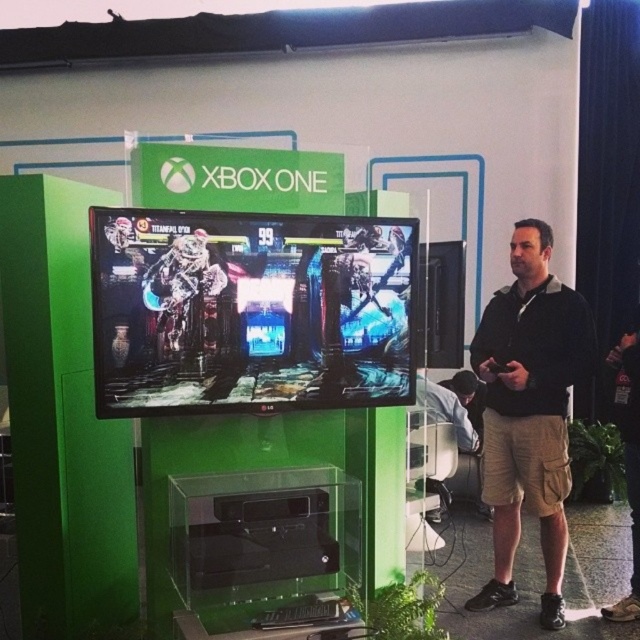
Question: Does shiny metallic screen at center have a smaller size compared to black cotton shirt at center?

Choices:
 (A) no
 (B) yes

Answer: (B)

Question: Does shiny metallic screen at center come behind black cotton shirt at center?

Choices:
 (A) yes
 (B) no

Answer: (B)

Question: In this image, where is shiny metallic screen at center located relative to black cotton shirt at center?

Choices:
 (A) above
 (B) below

Answer: (A)

Question: Which point appears closest to the camera in this image?

Choices:
 (A) (564, 342)
 (B) (248, 300)

Answer: (B)